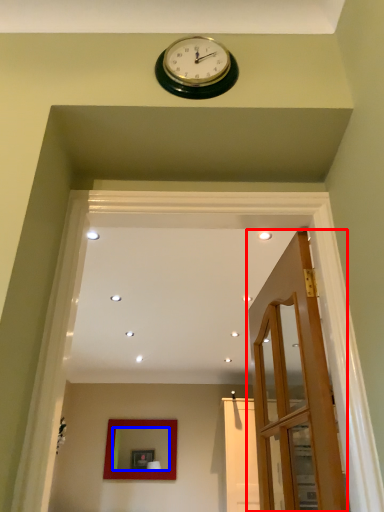
Question: Which object is closer to the camera taking this photo, door (highlighted by a red box) or mirror (highlighted by a blue box)?

Choices:
 (A) door
 (B) mirror

Answer: (A)